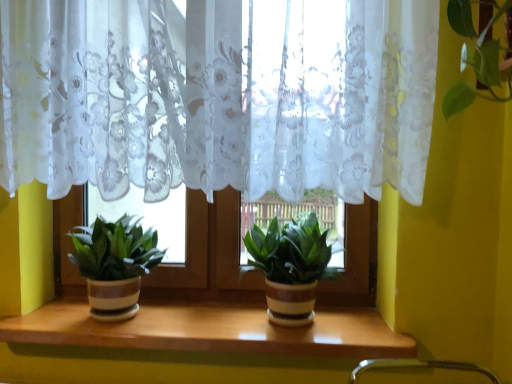
Image resolution: width=512 pixels, height=384 pixels. What are the coordinates of `vacant area situated below green matte plant pot at left, which is the second houseplant in right-to-left order (from a real-world perspective)` in the screenshot? It's located at (117, 318).